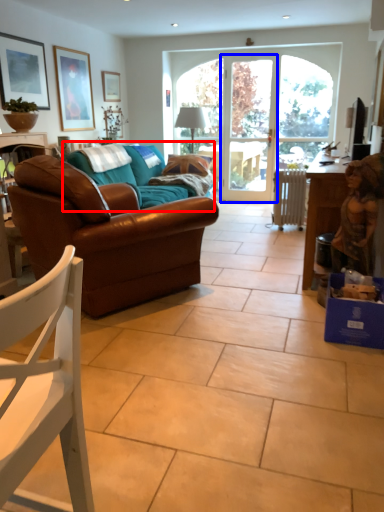
Question: Which object appears closest to the camera in this image, couch (highlighted by a red box) or screen door (highlighted by a blue box)?

Choices:
 (A) couch
 (B) screen door

Answer: (A)